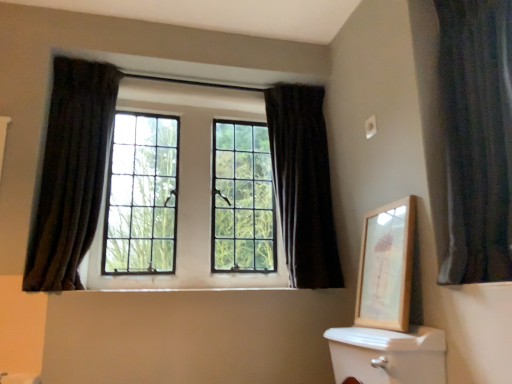
Question: From the image's perspective, is dark velvet curtain at right, which is counted as the 1th curtain, starting from the right, above or below dark velvet curtain at left, positioned as the 1th curtain in left-to-right order?

Choices:
 (A) below
 (B) above

Answer: (B)

Question: From a real-world perspective, relative to dark velvet curtain at left, the third curtain positioned from the right, is dark velvet curtain at right, which is counted as the 1th curtain, starting from the right, vertically above or below?

Choices:
 (A) above
 (B) below

Answer: (B)

Question: Considering the real-world distances, which object is farthest from the matte glass windows at center?

Choices:
 (A) dark velvet curtain at right, acting as the third curtain starting from the left
 (B) wooden picture frame at upper right
 (C) dark velvet curtain at left, positioned as the 1th curtain in left-to-right order
 (D) dark velvet curtain at upper center, the 2th curtain viewed from the left

Answer: (A)

Question: Which of these objects is positioned closest to the matte glass windows at center?

Choices:
 (A) dark velvet curtain at right, acting as the third curtain starting from the left
 (B) wooden picture frame at upper right
 (C) dark velvet curtain at left, positioned as the 1th curtain in left-to-right order
 (D) dark velvet curtain at upper center, the 2th curtain viewed from the left

Answer: (D)